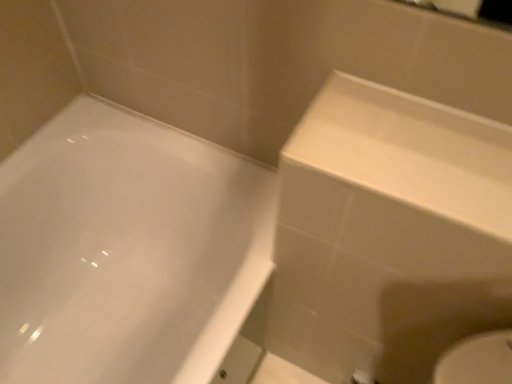
Measure the distance between white glossy bathtub at upper left and camera.

white glossy bathtub at upper left is 73.28 centimeters away from camera.

This screenshot has width=512, height=384. In order to click on white glossy bathtub at upper left in this screenshot , I will do `click(127, 250)`.

Describe the element at coordinates (127, 250) in the screenshot. I see `white glossy bathtub at upper left` at that location.

Where is `white glossy bathtub at upper left`? This screenshot has height=384, width=512. white glossy bathtub at upper left is located at coordinates (127, 250).